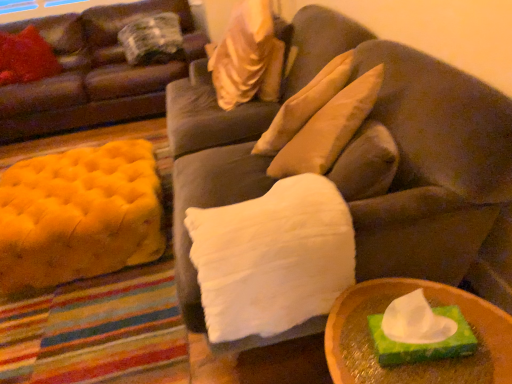
You are a GUI agent. You are given a task and a screenshot of the screen. Output one action in this format:
    pyautogui.click(x=<x>, y=<y>)
    Task: Click on the plaid fabric pillow at upper left, which is the second pillow from left to right
    The width and height of the screenshot is (512, 384).
    Given the screenshot: What is the action you would take?
    pyautogui.click(x=152, y=39)

Measure the distance between plaid fabric pillow at upper left, the 4th pillow in the front-to-back sequence, and camera.

11.01 feet.

Locate an element on the screen. Image resolution: width=512 pixels, height=384 pixels. velvet brown couch at center, marked as the second studio couch in a left-to-right arrangement is located at coordinates (419, 152).

This screenshot has width=512, height=384. I want to click on velvety red pillow at upper left, which is the fourth pillow in right-to-left order, so click(26, 57).

Locate an element on the screen. The height and width of the screenshot is (384, 512). satin beige pillow at upper center, marked as the 2th pillow in a front-to-back arrangement is located at coordinates (247, 57).

What do you see at coordinates (418, 363) in the screenshot? The height and width of the screenshot is (384, 512). I see `wooden tray at lower right` at bounding box center [418, 363].

This screenshot has height=384, width=512. What do you see at coordinates (272, 258) in the screenshot? I see `white fluffy pillow at center, placed as the 1th pillow when sorted from front to back` at bounding box center [272, 258].

The image size is (512, 384). Find the location of `plaid fabric pillow at upper left, which is the 1th pillow in back-to-front order`. plaid fabric pillow at upper left, which is the 1th pillow in back-to-front order is located at coordinates (152, 39).

Between velvet brown couch at center, marked as the second studio couch in a left-to-right arrangement, and wooden tray at lower right, which one has larger width?

velvet brown couch at center, marked as the second studio couch in a left-to-right arrangement, is wider.

From the image's perspective, which is above, velvet brown couch at center, the first studio couch when ordered from front to back, or wooden tray at lower right?

velvet brown couch at center, the first studio couch when ordered from front to back, is shown above in the image.

Is velvet brown couch at center, the 2th studio couch when ordered from back to front, facing away from wooden tray at lower right?

No, wooden tray at lower right is not at the back of velvet brown couch at center, the 2th studio couch when ordered from back to front.

Considering the sizes of objects velvety red pillow at upper left, which is counted as the 3th pillow, starting from the front, and velvet brown couch at upper left, the 1th studio couch positioned from the back, in the image provided, who is smaller, velvety red pillow at upper left, which is counted as the 3th pillow, starting from the front, or velvet brown couch at upper left, the 1th studio couch positioned from the back,?

velvety red pillow at upper left, which is counted as the 3th pillow, starting from the front.

How many degrees apart are the facing directions of velvety red pillow at upper left, the second pillow in the back-to-front sequence, and velvet brown couch at upper left, which is the 2th studio couch in right-to-left order?

65.9 degrees.

Is velvety red pillow at upper left, which is counted as the 3th pillow, starting from the front, not near velvet brown couch at upper left, which is the 2th studio couch in right-to-left order?

velvety red pillow at upper left, which is counted as the 3th pillow, starting from the front, is near velvet brown couch at upper left, which is the 2th studio couch in right-to-left order, not far away.

Between point (36, 63) and point (126, 104), which one is positioned in front?

The point (36, 63) is more forward.

In the scene shown: Can we say velvet brown couch at upper left, which is the second studio couch from front to back, lies outside wooden tray at lower right?

velvet brown couch at upper left, which is the second studio couch from front to back, lies outside wooden tray at lower right's area.

Considering the relative sizes of velvet brown couch at upper left, placed as the first studio couch when sorted from left to right, and wooden tray at lower right in the image provided, is velvet brown couch at upper left, placed as the first studio couch when sorted from left to right, wider than wooden tray at lower right?

Yes.

What are the coordinates of `table located underneath the velvet brown couch at upper left, the 1th studio couch positioned from the back (from a real-world perspective)` in the screenshot? It's located at (418, 363).

From the picture: Are velvet brown couch at upper left, which is the second studio couch from front to back, and wooden tray at lower right far apart?

Yes, velvet brown couch at upper left, which is the second studio couch from front to back, is far from wooden tray at lower right.

Is satin beige pillow at upper center, positioned as the 3th pillow in left-to-right order, facing towards plaid fabric pillow at upper left, which is the 1th pillow in back-to-front order?

No, satin beige pillow at upper center, positioned as the 3th pillow in left-to-right order, is not oriented towards plaid fabric pillow at upper left, which is the 1th pillow in back-to-front order.

From the image's perspective, between satin beige pillow at upper center, which is counted as the 3th pillow, starting from the back, and plaid fabric pillow at upper left, which is the 1th pillow in back-to-front order, who is located below?

satin beige pillow at upper center, which is counted as the 3th pillow, starting from the back, appears lower in the image.

How different are the orientations of satin beige pillow at upper center, which is the 2th pillow in right-to-left order, and plaid fabric pillow at upper left, which is the 1th pillow in back-to-front order, in degrees?

The facing directions of satin beige pillow at upper center, which is the 2th pillow in right-to-left order, and plaid fabric pillow at upper left, which is the 1th pillow in back-to-front order, are 95.1 degrees apart.

Is satin beige pillow at upper center, marked as the 2th pillow in a front-to-back arrangement, in front of or behind plaid fabric pillow at upper left, which is the 1th pillow in back-to-front order, in the image?

satin beige pillow at upper center, marked as the 2th pillow in a front-to-back arrangement, is in front of plaid fabric pillow at upper left, which is the 1th pillow in back-to-front order.

Is plaid fabric pillow at upper left, which is the 1th pillow in back-to-front order, looking in the opposite direction of velvety red pillow at upper left, which is the fourth pillow in right-to-left order?

plaid fabric pillow at upper left, which is the 1th pillow in back-to-front order, does not have its back to velvety red pillow at upper left, which is the fourth pillow in right-to-left order.

Is plaid fabric pillow at upper left, which is the 1th pillow in back-to-front order, positioned beyond the bounds of velvety red pillow at upper left, which is counted as the 3th pillow, starting from the front?

Indeed, plaid fabric pillow at upper left, which is the 1th pillow in back-to-front order, is completely outside velvety red pillow at upper left, which is counted as the 3th pillow, starting from the front.

Are plaid fabric pillow at upper left, the 4th pillow in the front-to-back sequence, and velvety red pillow at upper left, marked as the 1th pillow in a left-to-right arrangement, far apart?

No.

Does wooden tray at lower right have a greater width compared to satin beige pillow at upper center, which is counted as the 3th pillow, starting from the back?

No.

Between wooden tray at lower right and satin beige pillow at upper center, marked as the 2th pillow in a front-to-back arrangement, which one appears on the left side from the viewer's perspective?

satin beige pillow at upper center, marked as the 2th pillow in a front-to-back arrangement, is more to the left.

Is wooden tray at lower right located outside satin beige pillow at upper center, which is counted as the 3th pillow, starting from the back?

That's correct, wooden tray at lower right is outside of satin beige pillow at upper center, which is counted as the 3th pillow, starting from the back.

Does wooden tray at lower right have a larger size compared to satin beige pillow at upper center, positioned as the 3th pillow in left-to-right order?

No, wooden tray at lower right is not bigger than satin beige pillow at upper center, positioned as the 3th pillow in left-to-right order.

From a real-world perspective, which object stands above the other?

satin beige pillow at upper center, positioned as the 3th pillow in left-to-right order.

Looking at this image, from the image's perspective, which one is positioned higher, satin beige pillow at upper center, marked as the 2th pillow in a front-to-back arrangement, or wooden tray at lower right?

satin beige pillow at upper center, marked as the 2th pillow in a front-to-back arrangement.

How distant is satin beige pillow at upper center, which is the 2th pillow in right-to-left order, from wooden tray at lower right?

satin beige pillow at upper center, which is the 2th pillow in right-to-left order, is 1.56 meters away from wooden tray at lower right.

Considering the relative sizes of satin beige pillow at upper center, positioned as the 3th pillow in left-to-right order, and wooden tray at lower right in the image provided, is satin beige pillow at upper center, positioned as the 3th pillow in left-to-right order, smaller than wooden tray at lower right?

Incorrect, satin beige pillow at upper center, positioned as the 3th pillow in left-to-right order, is not smaller in size than wooden tray at lower right.

Image resolution: width=512 pixels, height=384 pixels. In order to click on table located below the velvet brown couch at center, the first studio couch when ordered from front to back (from the image's perspective) in this screenshot , I will do `click(418, 363)`.

The image size is (512, 384). In order to click on studio couch that is the 1st one when counting rightward from the velvety red pillow at upper left, marked as the 1th pillow in a left-to-right arrangement in this screenshot , I will do `click(95, 74)`.

Looking at the image, which one is located further to yellow tufted ottoman at left, velvet brown couch at upper left, which is the 2th studio couch in right-to-left order, or white fluffy pillow at center, which is the 1th pillow in right-to-left order?

velvet brown couch at upper left, which is the 2th studio couch in right-to-left order, is positioned further to the anchor yellow tufted ottoman at left.

Looking at the image, which one is located closer to velvety red pillow at upper left, the second pillow in the back-to-front sequence, wooden tray at lower right or velvet brown couch at center, marked as the second studio couch in a left-to-right arrangement?

Among the two, velvet brown couch at center, marked as the second studio couch in a left-to-right arrangement, is located nearer to velvety red pillow at upper left, the second pillow in the back-to-front sequence.

Estimate the real-world distances between objects in this image. Which object is further from yellow tufted ottoman at left, velvet brown couch at center, marked as the second studio couch in a left-to-right arrangement, or velvet brown couch at upper left, which is the 2th studio couch in right-to-left order?

velvet brown couch at upper left, which is the 2th studio couch in right-to-left order, lies further to yellow tufted ottoman at left than the other object.

Which object lies further to the anchor point satin beige pillow at upper center, marked as the 2th pillow in a front-to-back arrangement, velvet brown couch at upper left, placed as the first studio couch when sorted from left to right, or plaid fabric pillow at upper left, which is the 1th pillow in back-to-front order?

The object further to satin beige pillow at upper center, marked as the 2th pillow in a front-to-back arrangement, is velvet brown couch at upper left, placed as the first studio couch when sorted from left to right.

Looking at the image, which one is located further to plaid fabric pillow at upper left, which is the 1th pillow in back-to-front order, velvet brown couch at upper left, which is the 2th studio couch in right-to-left order, or white fluffy pillow at center, which is the 1th pillow in right-to-left order?

white fluffy pillow at center, which is the 1th pillow in right-to-left order.

When comparing their distances from velvety red pillow at upper left, which is counted as the 3th pillow, starting from the front, does white fluffy pillow at center, placed as the 4th pillow when sorted from back to front, or velvet brown couch at center, the first studio couch when ordered from front to back, seem further?

Based on the image, white fluffy pillow at center, placed as the 4th pillow when sorted from back to front, appears to be further to velvety red pillow at upper left, which is counted as the 3th pillow, starting from the front.

Looking at the image, which one is located closer to yellow tufted ottoman at left, velvet brown couch at upper left, placed as the first studio couch when sorted from left to right, or velvet brown couch at center, marked as the second studio couch in a left-to-right arrangement?

velvet brown couch at center, marked as the second studio couch in a left-to-right arrangement.

Looking at the image, which one is located closer to yellow tufted ottoman at left, white fluffy pillow at center, placed as the 4th pillow when sorted from back to front, or wooden tray at lower right?

white fluffy pillow at center, placed as the 4th pillow when sorted from back to front, is closer to yellow tufted ottoman at left.

You are a GUI agent. You are given a task and a screenshot of the screen. Output one action in this format:
    pyautogui.click(x=<x>, y=<y>)
    Task: Click on the stool between velvet brown couch at center, the first studio couch when ordered from front to back, and velvety red pillow at upper left, which is the fourth pillow in right-to-left order, from front to back
    Image resolution: width=512 pixels, height=384 pixels.
    Given the screenshot: What is the action you would take?
    pyautogui.click(x=79, y=215)

Where is `stool located between wooden tray at lower right and velvet brown couch at upper left, which is the second studio couch from front to back, in the depth direction`? stool located between wooden tray at lower right and velvet brown couch at upper left, which is the second studio couch from front to back, in the depth direction is located at coordinates (79, 215).

You are a GUI agent. You are given a task and a screenshot of the screen. Output one action in this format:
    pyautogui.click(x=<x>, y=<y>)
    Task: Click on the stool between wooden tray at lower right and plaid fabric pillow at upper left, the 4th pillow in the front-to-back sequence, along the z-axis
    The width and height of the screenshot is (512, 384).
    Given the screenshot: What is the action you would take?
    pyautogui.click(x=79, y=215)

Identify the location of studio couch positioned between yellow tufted ottoman at left and velvety red pillow at upper left, which is counted as the 3th pillow, starting from the front, from near to far. This screenshot has height=384, width=512. (95, 74).